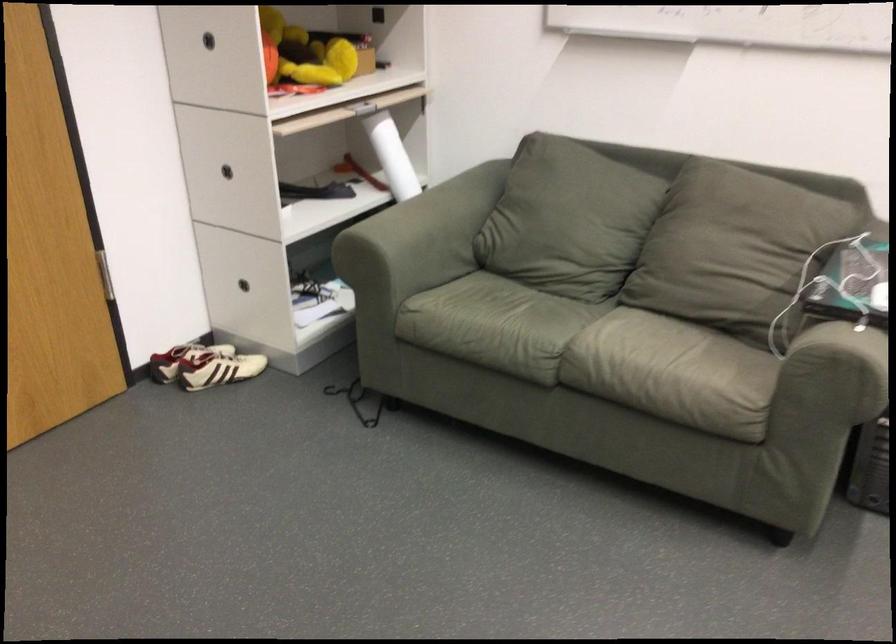
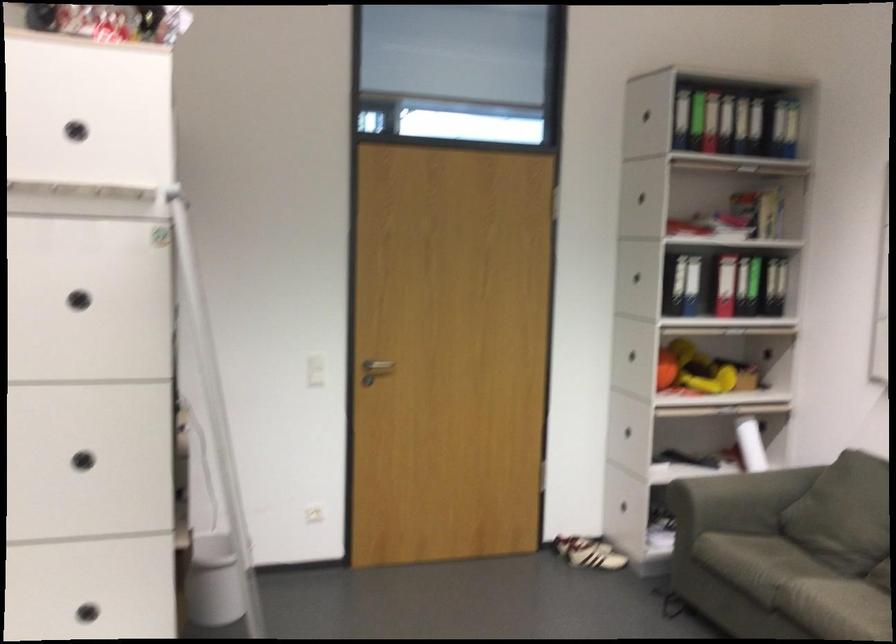
The point at [406,158] is marked in the first image. Where is the corresponding point in the second image?

(750, 444)